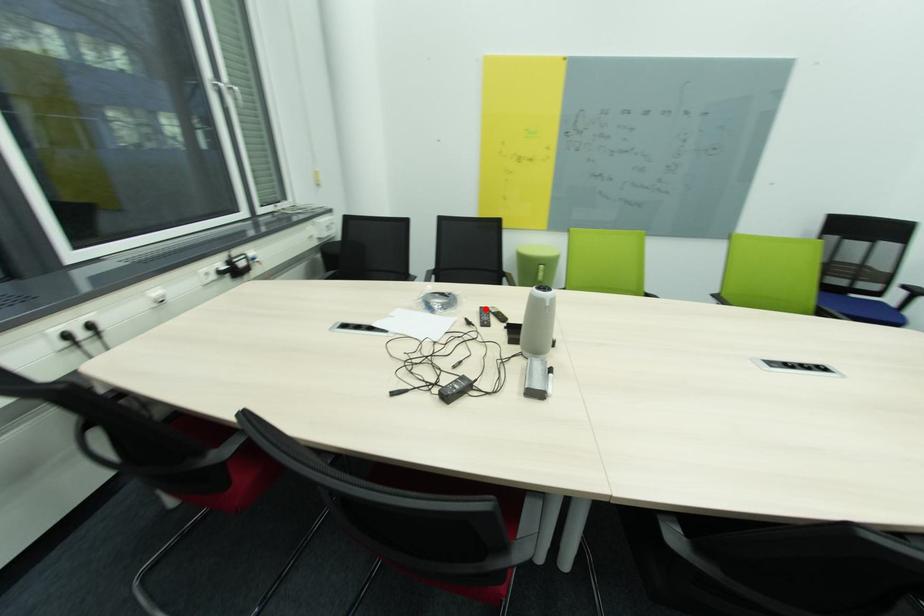
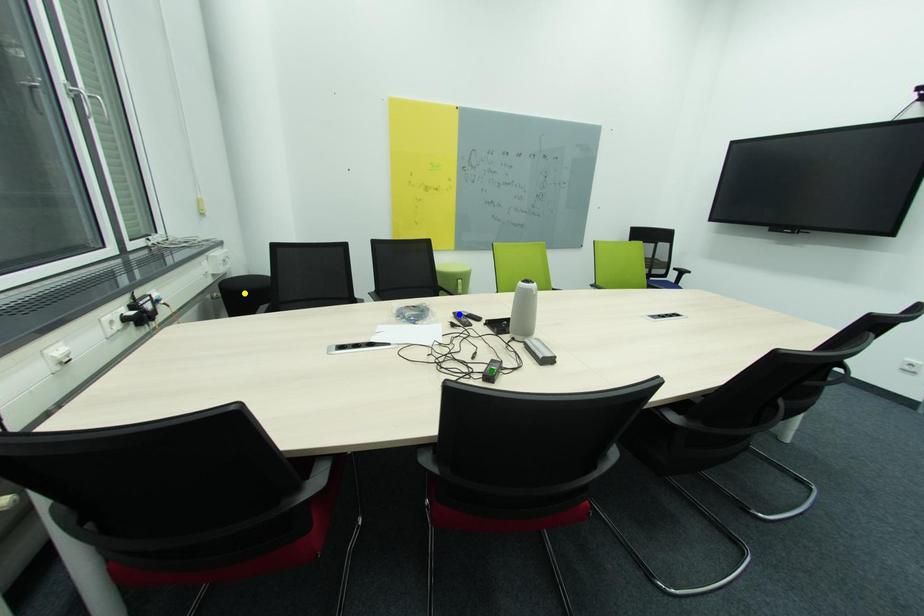
Question: I am providing you with two images of the same scene from different viewpoints. A red point is marked on the first image. You are given multiple points on the second image. Can you choose the point in image 2 that corresponds to the point in image 1?

Choices:
 (A) blue point
 (B) yellow point
 (C) green point

Answer: (A)